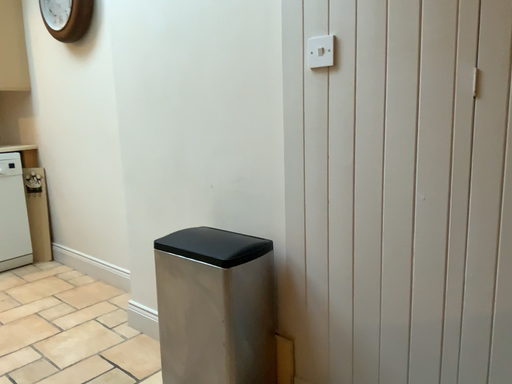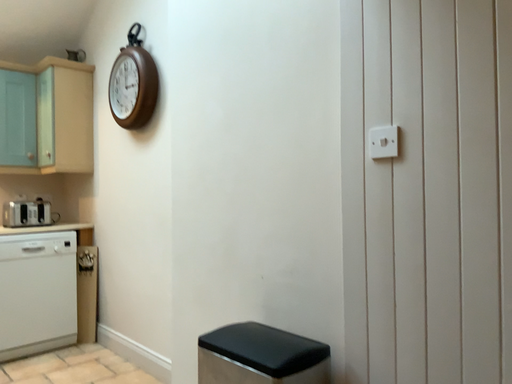
Question: Which way did the camera rotate in the video?

Choices:
 (A) rotated right
 (B) rotated left

Answer: (B)